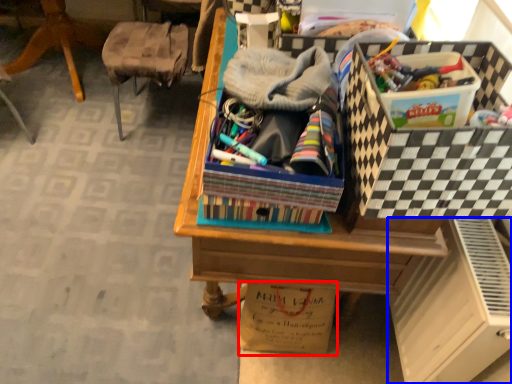
Question: Which point is further to the camera, cardboard box (highlighted by a red box) or file cabinet (highlighted by a blue box)?

Choices:
 (A) cardboard box
 (B) file cabinet

Answer: (A)